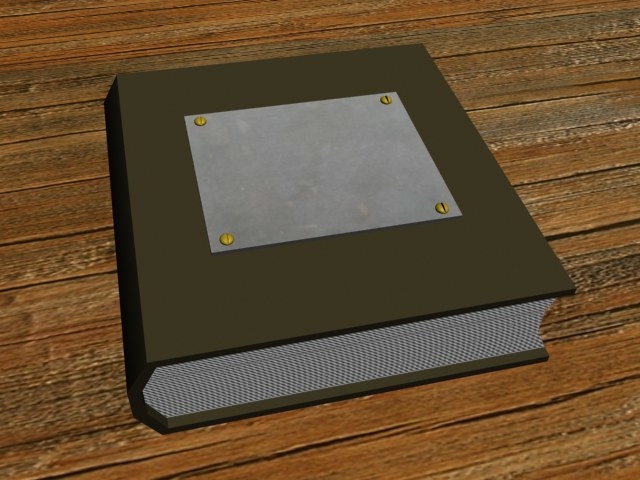
Identify the location of book. Image resolution: width=640 pixels, height=480 pixels. (473, 274).